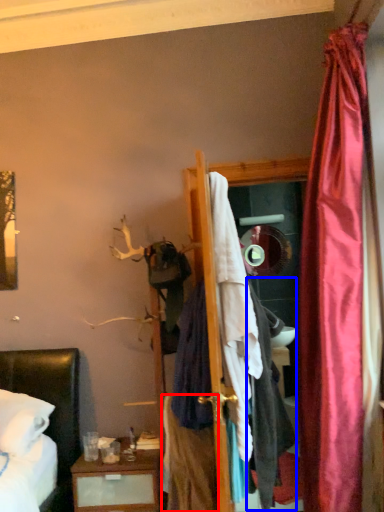
Question: Among these objects, which one is farthest to the camera, clothing (highlighted by a red box) or clothing (highlighted by a blue box)?

Choices:
 (A) clothing
 (B) clothing

Answer: (A)